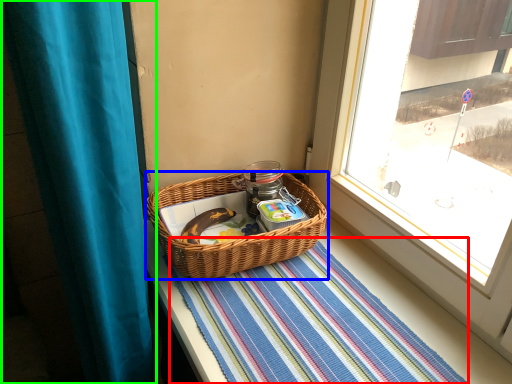
Question: Estimate the real-world distances between objects in this image. Which object is farther from mat (highlighted by a red box), picnic basket (highlighted by a blue box) or curtain (highlighted by a green box)?

Choices:
 (A) picnic basket
 (B) curtain

Answer: (B)